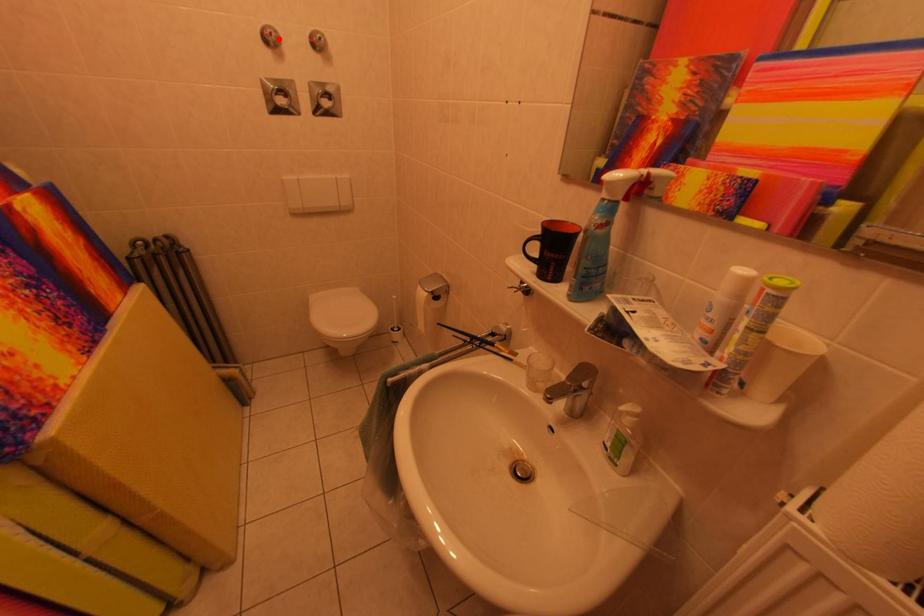
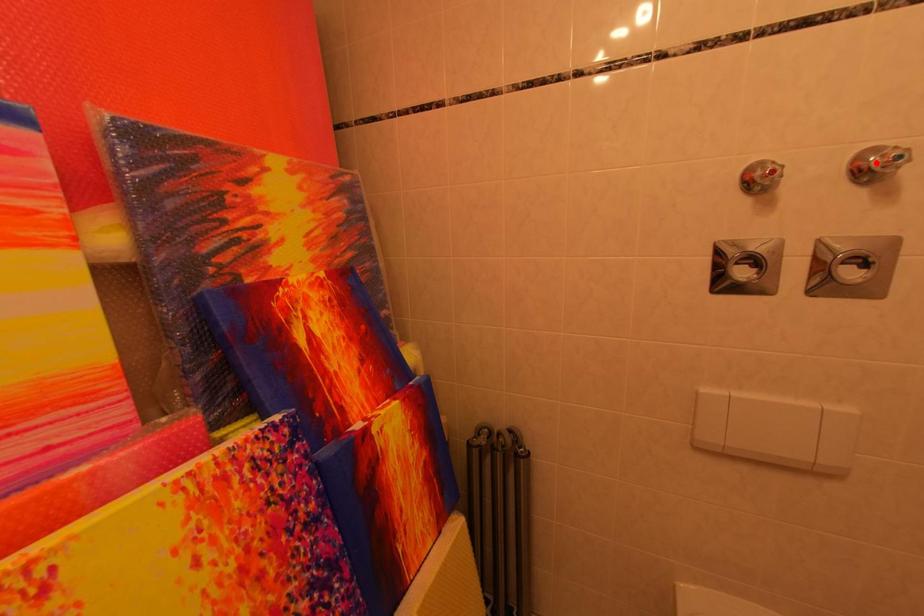
I am providing you with two images of the same scene from different viewpoints. A red point is marked on the first image and another point is marked on the second image. Is the marked point in image1 the same physical position as the marked point in image2?

No